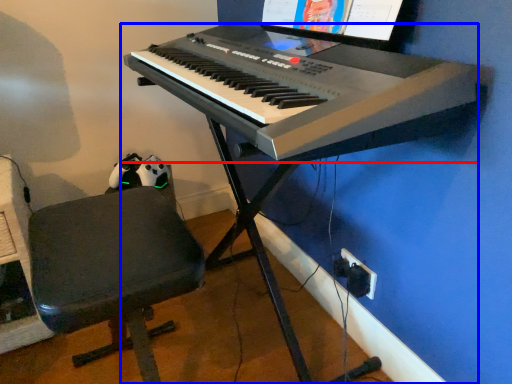
Question: Among these objects, which one is nearest to the camera, musical keyboard (highlighted by a red box) or piano (highlighted by a blue box)?

Choices:
 (A) musical keyboard
 (B) piano

Answer: (A)